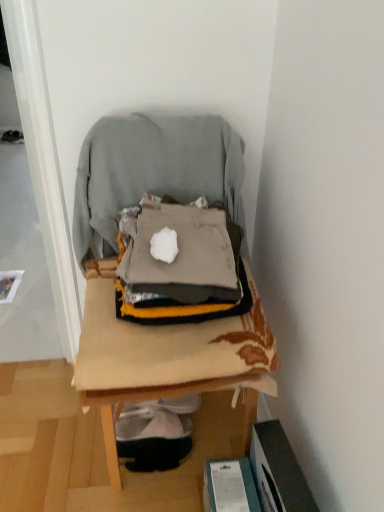
Question: From a real-world perspective, is gray fabric bean bag chair at center positioned above or below wooden chair at center?

Choices:
 (A) above
 (B) below

Answer: (A)

Question: From the image's perspective, is gray fabric bean bag chair at center positioned above or below wooden chair at center?

Choices:
 (A) below
 (B) above

Answer: (B)

Question: Based on their sizes in the image, would you say gray fabric bean bag chair at center is bigger or smaller than wooden chair at center?

Choices:
 (A) small
 (B) big

Answer: (A)

Question: From the image's perspective, is wooden chair at center above or below gray fabric bean bag chair at center?

Choices:
 (A) above
 (B) below

Answer: (B)

Question: Relative to gray fabric bean bag chair at center, is wooden chair at center in front or behind?

Choices:
 (A) front
 (B) behind

Answer: (A)

Question: From a real-world perspective, relative to gray fabric bean bag chair at center, is wooden chair at center vertically above or below?

Choices:
 (A) below
 (B) above

Answer: (A)

Question: Which is correct: wooden chair at center is inside gray fabric bean bag chair at center, or outside of it?

Choices:
 (A) inside
 (B) outside

Answer: (B)